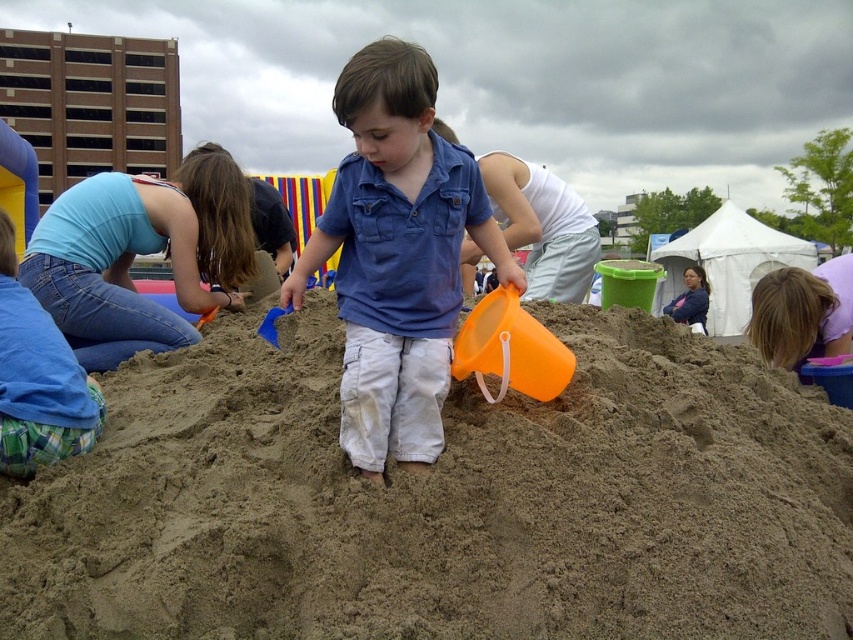
Question: Is smooth sand mound at center smaller than blue denim shirt at center?

Choices:
 (A) yes
 (B) no

Answer: (B)

Question: Does smooth sand mound at center have a smaller size compared to blue denim shirt at center?

Choices:
 (A) yes
 (B) no

Answer: (B)

Question: Which object appears closest to the camera in this image?

Choices:
 (A) smooth sand mound at center
 (B) blue denim shirt at center

Answer: (A)

Question: Can you confirm if smooth sand mound at center is smaller than blue denim shirt at center?

Choices:
 (A) yes
 (B) no

Answer: (B)